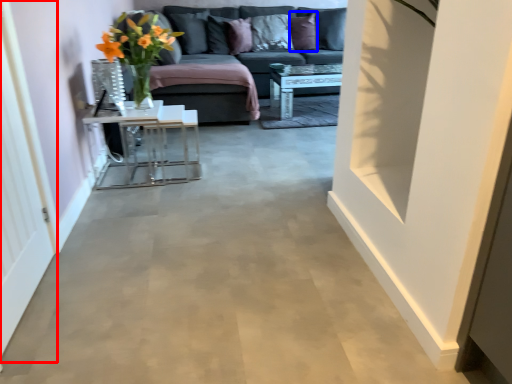
Question: Which object is closer to the camera taking this photo, glass door (highlighted by a red box) or pillow (highlighted by a blue box)?

Choices:
 (A) glass door
 (B) pillow

Answer: (A)